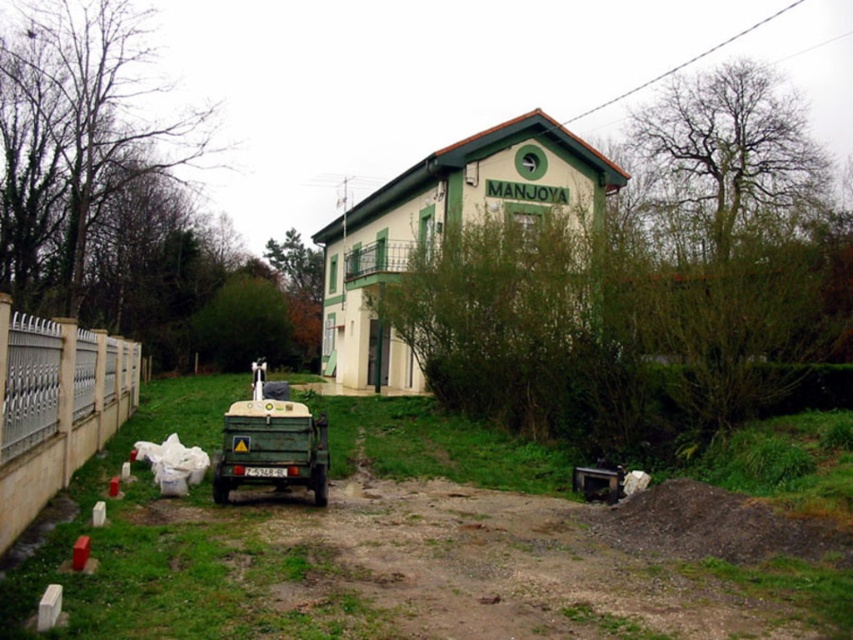
Which of these two, white metal fence at lower left or green matte truck at lower left, stands shorter?

With less height is green matte truck at lower left.

Does white metal fence at lower left come behind green matte truck at lower left?

No, white metal fence at lower left is closer to the viewer.

Does point (35, 433) come farther from viewer compared to point (239, 452)?

That is False.

Image resolution: width=853 pixels, height=640 pixels. Find the location of `white metal fence at lower left`. white metal fence at lower left is located at coordinates (55, 406).